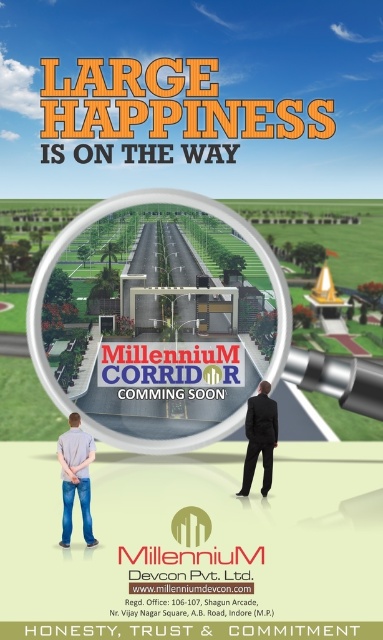
You are a graphic designer reviewing the advertisement for the Millennium Corridor project. You need to ensure that the transparent glass magnifying glass at center and the light gray shirt at lower left are properly aligned. According to the design, which object is positioned to the right of the other?

The transparent glass magnifying glass at center is positioned on the right side of light gray shirt at lower left.

You are a project manager looking at the promotional image for the Millennium Corridor development. You notice two individuals in the scene, one wearing a light gray shirt at lower left and another in a black suit at center. Which individual is positioned more to the left side of the image?

The light gray shirt at lower left is positioned more to the left side of the image compared to the black suit at center.

Where is the transparent glass magnifying glass at center located in the image?

The transparent glass magnifying glass at center is located at point [139,204] in the image.